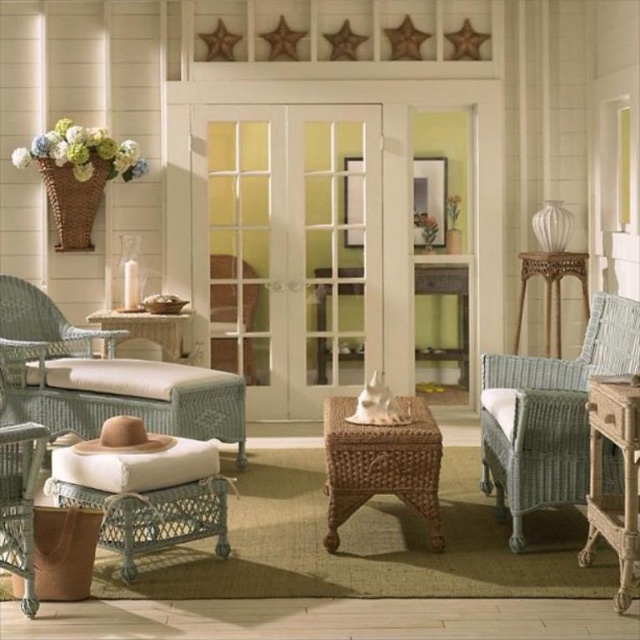
Which of these two, white wicker stool at lower left or woven wicker armchair at center, stands shorter?

white wicker stool at lower left

Who is more distant from viewer, (x=118, y=456) or (x=234, y=346)?

The point (x=234, y=346) is more distant.

Who is more forward, (177, 515) or (220, 282)?

Point (177, 515) is in front.

In order to click on white wicker stool at lower left in this screenshot , I will do `click(147, 497)`.

Does rattan stool at center lie behind woven wicker armchair at center?

No, it is not.

Which is behind, point (412, 426) or point (227, 371)?

The point (227, 371) is behind.

Identify the location of rattan stool at center. (381, 465).

Does woven light blue armchair at right appear on the right side of woven wicker armchair at center?

Indeed, woven light blue armchair at right is positioned on the right side of woven wicker armchair at center.

Does woven light blue armchair at right have a greater height compared to woven wicker armchair at center?

Indeed, woven light blue armchair at right has a greater height compared to woven wicker armchair at center.

Describe the element at coordinates (548, 413) in the screenshot. This screenshot has height=640, width=640. I see `woven light blue armchair at right` at that location.

You are a GUI agent. You are given a task and a screenshot of the screen. Output one action in this format:
    pyautogui.click(x=<x>, y=<y>)
    Task: Click on the woven light blue armchair at right
    
    Given the screenshot: What is the action you would take?
    pyautogui.click(x=548, y=413)